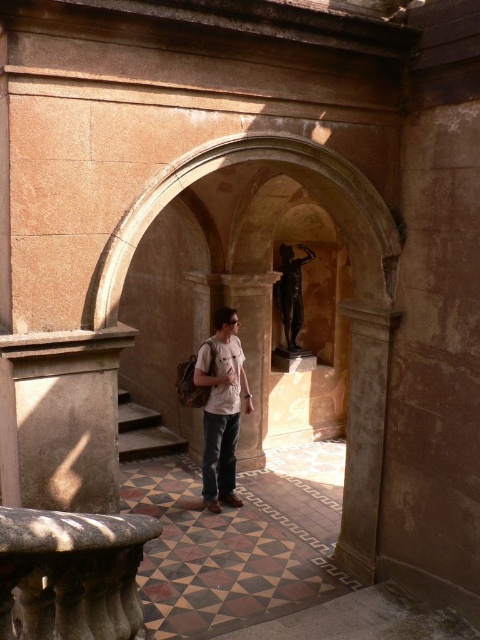
Question: Which object is farther from the camera taking this photo?

Choices:
 (A) brown stone pillar at center
 (B) marble balustrade at lower left
 (C) smooth stone stairs at center

Answer: (C)

Question: Is marble balustrade at lower left to the left of brown stone pillar at center from the viewer's perspective?

Choices:
 (A) yes
 (B) no

Answer: (A)

Question: Among these objects, which one is nearest to the camera?

Choices:
 (A) brown stone pillar at center
 (B) white cotton shirt at center
 (C) bronze statue at center
 (D) smooth stone stairs at center

Answer: (B)

Question: Which point is closer to the camera?

Choices:
 (A) smooth stone stairs at center
 (B) marble balustrade at lower left

Answer: (B)

Question: Can you confirm if marble balustrade at lower left is bigger than brown stone pillar at center?

Choices:
 (A) yes
 (B) no

Answer: (B)

Question: Does white cotton shirt at center appear under smooth stone stairs at center?

Choices:
 (A) no
 (B) yes

Answer: (A)